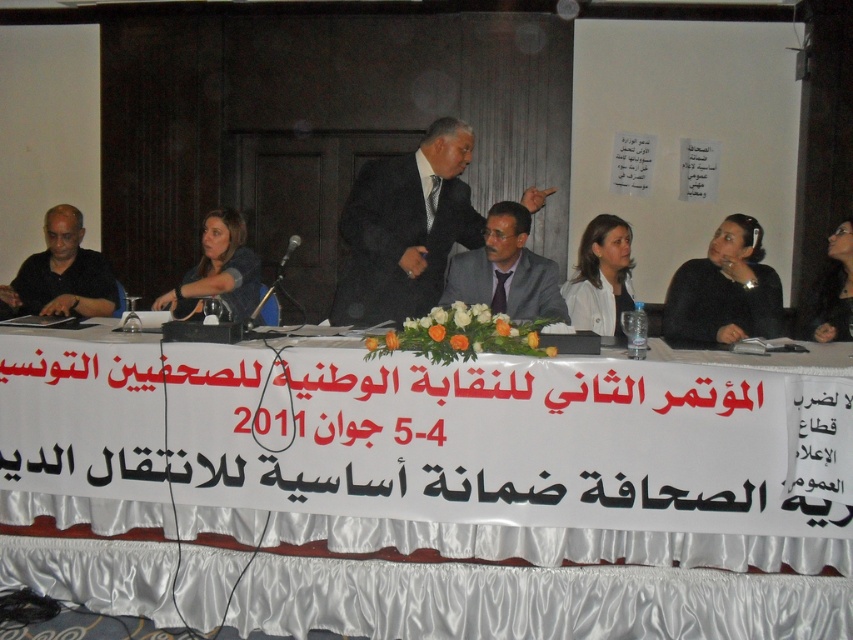
You are a photographer at the press conference. You need to capture a photo that includes both the black suit at center and the white matte jacket at center. Which one should be placed on the left side of the photo to ensure both are visible?

The black suit at center is to the left of the white matte jacket at center, so placing the black suit at center on the left side of the photo will ensure both are visible.

You are organizing a press conference and need to place a matte black jacket at left on the white satin tablecloth at center. Will the jacket fit on the tablecloth without hanging off the edges?

The white satin tablecloth at center might be wider than matte black jacket at left, so there is a possibility that the matte black jacket at left will fit on the tablecloth without hanging off the edges. However, since the exact dimensions are not provided, it is recommended to check the actual measurements for confirmation.

From the picture: You are a photographer setting up for a press conference. You need to position your camera so that both the white satin tablecloth at center and the black suit at center are in frame. Based on their positions, which object is wider and might require more space in the camera frame?

The white satin tablecloth at center might be wider than the black suit at center, so it would require more space in the camera frame.